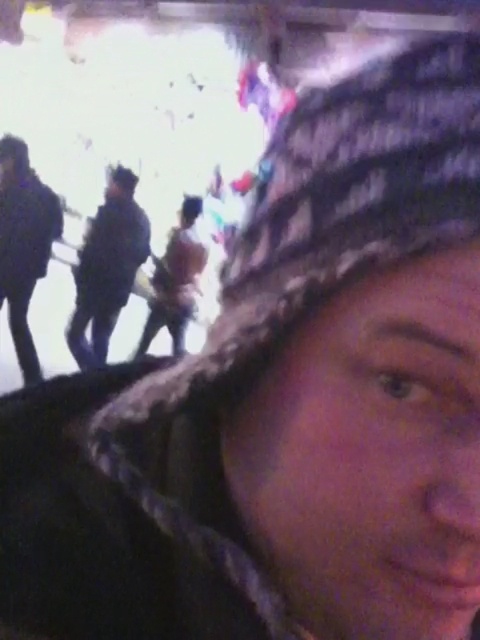
Does dark blue uniform at center appear on the right side of dark blue jacket at left?

Correct, you'll find dark blue uniform at center to the right of dark blue jacket at left.

The image size is (480, 640). Find the location of `dark blue uniform at center`. dark blue uniform at center is located at coordinates (107, 268).

Measure the distance from dark blue uniform at center to brown fuzzy coat at center.

dark blue uniform at center is 26.96 centimeters away from brown fuzzy coat at center.

Who is taller, dark blue uniform at center or brown fuzzy coat at center?

dark blue uniform at center is taller.

Which is behind, point (131, 230) or point (172, 234)?

Point (172, 234)

This screenshot has height=640, width=480. I want to click on dark blue uniform at center, so click(107, 268).

Which is more to the right, dark blue jacket at left or brown fuzzy coat at center?

Positioned to the right is brown fuzzy coat at center.

Does dark blue jacket at left have a greater width compared to brown fuzzy coat at center?

No, dark blue jacket at left is not wider than brown fuzzy coat at center.

This screenshot has width=480, height=640. In order to click on dark blue jacket at left in this screenshot , I will do `click(24, 243)`.